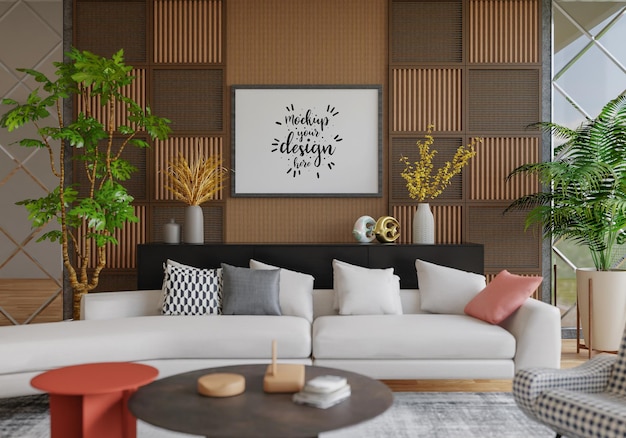
Find the location of a particular element. The image size is (626, 438). white planter is located at coordinates (603, 321).